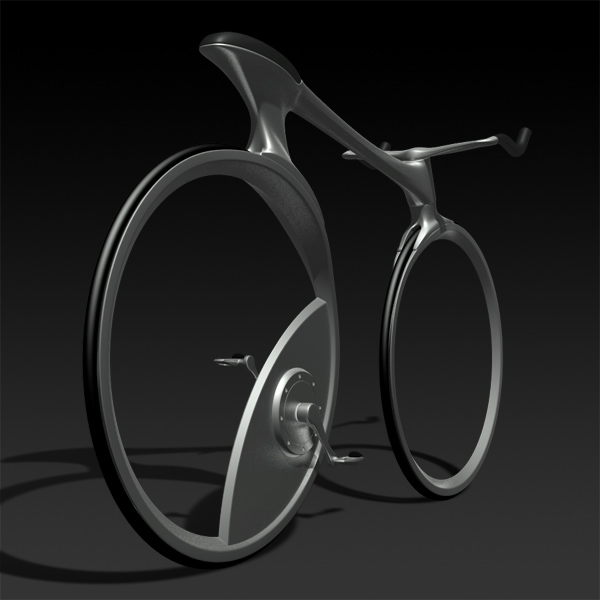
At what (x,y) coordinates should I click in order to perform the action: click on handle. Please return your answer as a coordinate pair (x, y). The image size is (600, 600). Looking at the image, I should click on (519, 146).